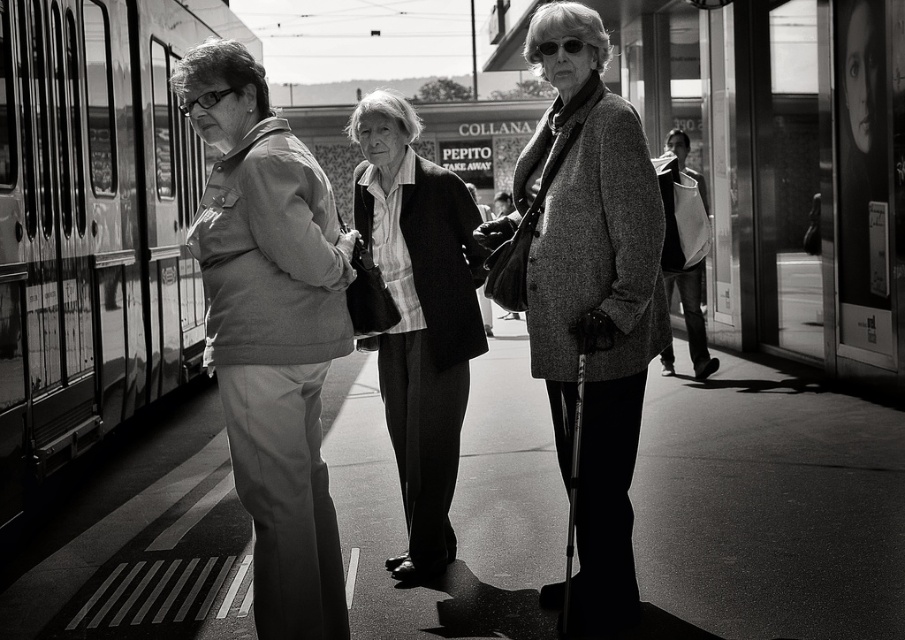
Question: Which object appears farthest from the camera in this image?

Choices:
 (A) white cotton jacket at right
 (B) metallic train at left

Answer: (A)

Question: Does matte gray jacket at left come behind textured gray coat at center?

Choices:
 (A) no
 (B) yes

Answer: (A)

Question: Estimate the real-world distances between objects in this image. Which object is closer to the smooth black blazer at center?

Choices:
 (A) metallic train at left
 (B) white cotton jacket at right
 (C) matte gray sweater at center
 (D) textured gray coat at center

Answer: (C)

Question: Is metallic train at left above textured gray coat at center?

Choices:
 (A) no
 (B) yes

Answer: (B)

Question: Where is matte gray sweater at center located in relation to matte gray jacket at left in the image?

Choices:
 (A) right
 (B) left

Answer: (A)

Question: Estimate the real-world distances between objects in this image. Which object is farther from the matte gray sweater at center?

Choices:
 (A) white cotton jacket at right
 (B) matte gray jacket at left
 (C) metallic train at left
 (D) textured gray coat at center

Answer: (A)